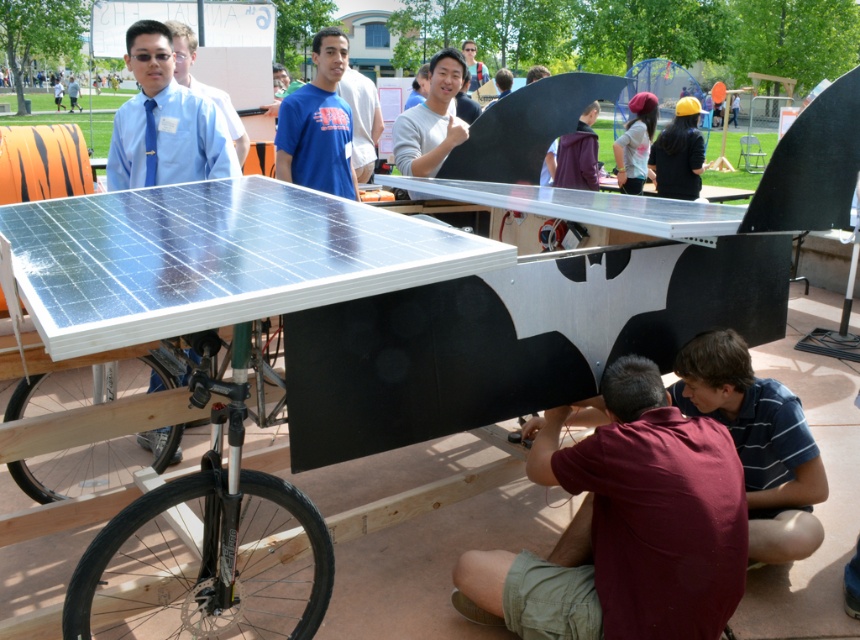
You are standing at the back of the image and want to place a tool on the transparent plastic table at center without moving the blue striped shirt at lower right. Is the table accessible from your current position?

The transparent plastic table at center is in front of the blue striped shirt at lower right, so if you are at the back of the image, the table is between you and the shirt. This means the table is accessible from your current position without needing to move the shirt.

You are an engineer observing the solar project team. You notice two workers at the center of the scene. One is wearing a smooth gray shirt at center, and the other has a light pink fabric at center. Which worker is positioned lower in the image?

The smooth gray shirt at center is below the light pink fabric at center, so the worker in the smooth gray shirt at center is positioned lower in the image.

In the image of the solar project, where is the light pink fabric at center located in terms of coordinates?

The light pink fabric at center is located at coordinates point (636, 141).